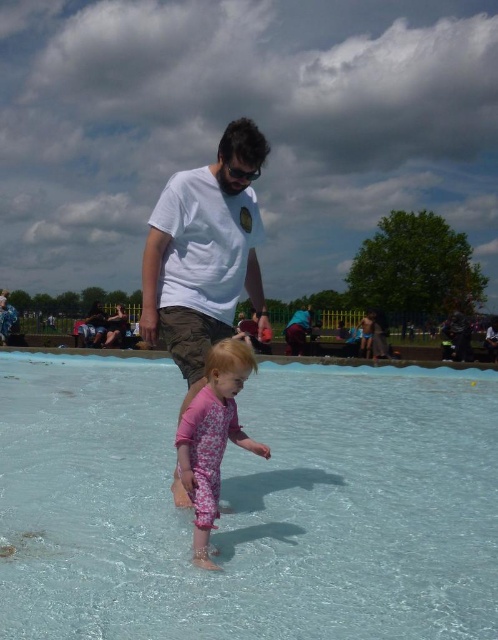
You are standing at the edge of the splash pad area and see the point marked at coordinates (249,504). What object is located at that point?

The point at (249,504) corresponds to the transparent plastic pool at center.